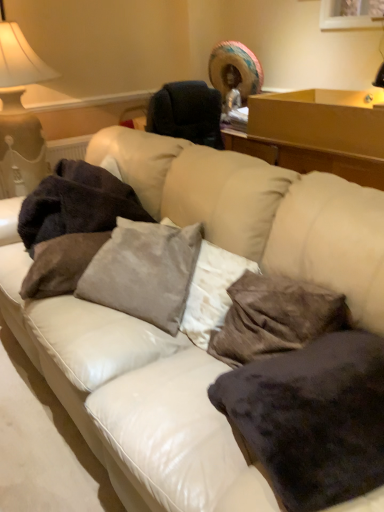
Question: Is velvety dark brown pillow at lower right, which is the fourth pillow in left-to-right order, wider than matte white lampshade at upper left?

Choices:
 (A) no
 (B) yes

Answer: (A)

Question: Is velvety dark brown pillow at lower right, marked as the 1th pillow in a right-to-left arrangement, taller than matte white lampshade at upper left?

Choices:
 (A) yes
 (B) no

Answer: (B)

Question: Is velvety dark brown pillow at lower right, which is the fourth pillow in left-to-right order, outside matte white lampshade at upper left?

Choices:
 (A) no
 (B) yes

Answer: (B)

Question: Does velvety dark brown pillow at lower right, marked as the 1th pillow in a right-to-left arrangement, have a larger size compared to matte white lampshade at upper left?

Choices:
 (A) no
 (B) yes

Answer: (A)

Question: From a real-world perspective, is velvety dark brown pillow at lower right, which is the fourth pillow in left-to-right order, located beneath matte white lampshade at upper left?

Choices:
 (A) no
 (B) yes

Answer: (B)

Question: From the image's perspective, is velvety dark brown pillow at lower right, which is the fourth pillow in left-to-right order, located above matte white lampshade at upper left?

Choices:
 (A) yes
 (B) no

Answer: (B)

Question: Does velvet gray pillow at center, positioned as the 2th pillow in left-to-right order, come in front of matte white lampshade at upper left?

Choices:
 (A) no
 (B) yes

Answer: (B)

Question: Is velvet gray pillow at center, which is the third pillow from right to left, turned away from matte white lampshade at upper left?

Choices:
 (A) yes
 (B) no

Answer: (B)

Question: Is velvet gray pillow at center, positioned as the 2th pillow in left-to-right order, shorter than matte white lampshade at upper left?

Choices:
 (A) yes
 (B) no

Answer: (A)

Question: From the image's perspective, would you say velvet gray pillow at center, which is the third pillow from right to left, is shown under matte white lampshade at upper left?

Choices:
 (A) no
 (B) yes

Answer: (B)

Question: From a real-world perspective, is velvet gray pillow at center, positioned as the 2th pillow in left-to-right order, beneath matte white lampshade at upper left?

Choices:
 (A) yes
 (B) no

Answer: (A)

Question: Is velvet gray pillow at center, which is the third pillow from right to left, facing towards matte white lampshade at upper left?

Choices:
 (A) yes
 (B) no

Answer: (B)

Question: Considering the relative sizes of dark brown plush blanket at left and velvet gray pillow at center, positioned as the 2th pillow in left-to-right order, in the image provided, is dark brown plush blanket at left smaller than velvet gray pillow at center, positioned as the 2th pillow in left-to-right order,?

Choices:
 (A) yes
 (B) no

Answer: (B)